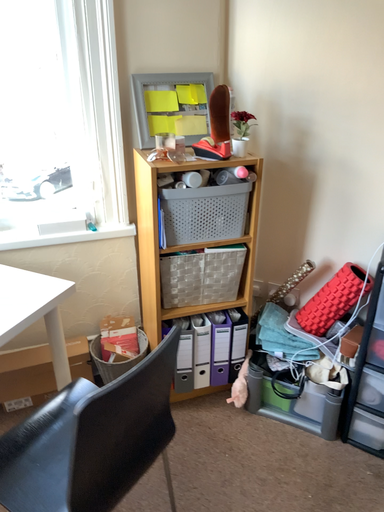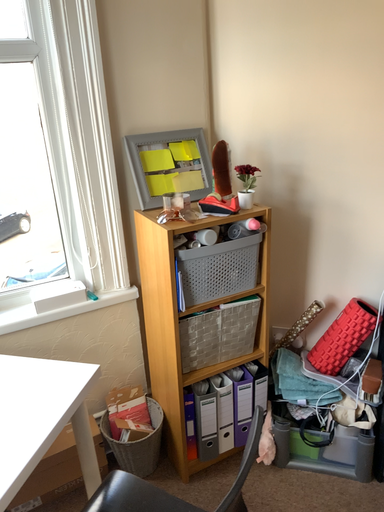
Question: Which way did the camera rotate in the video?

Choices:
 (A) rotated left
 (B) rotated right

Answer: (B)